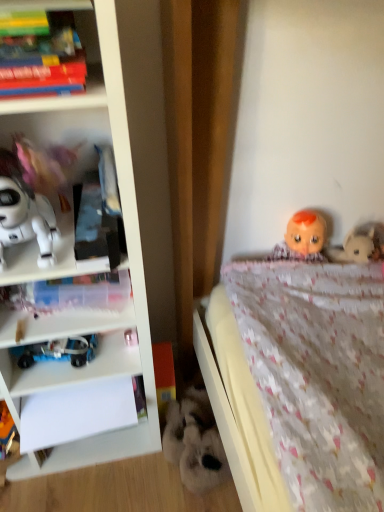
Question: From the image's perspective, is blue plastic toy at lower left, the 3th toy when ordered from top to bottom, above or below matte plastic books at upper left?

Choices:
 (A) above
 (B) below

Answer: (B)

Question: Considering the positions of point (18, 353) and point (34, 109), is point (18, 353) closer or farther from the camera than point (34, 109)?

Choices:
 (A) closer
 (B) farther

Answer: (B)

Question: Which is farther from the white matte robot at left, arranged as the 4th toy when viewed from the right?

Choices:
 (A) blue plastic toy at lower left, the 3th toy when ordered from top to bottom
 (B) white plastic bookcase at left
 (C) transparent plastic book at left
 (D) matte plastic books at upper left
 (E) pink fabric doll at left, which ranks as the 1th toy in top-to-bottom order

Answer: (A)

Question: Based on their relative distances, which object is farther from the white matte robot at left, the third toy in the bottom-to-top sequence?

Choices:
 (A) fluffy white stuffed animal at lower center, which is counted as the first toy, starting from the bottom
 (B) matte plastic books at upper left
 (C) transparent plastic book at left
 (D) white plastic bookcase at left
 (E) pink fabric doll at left, which is the 3th toy from left to right

Answer: (A)